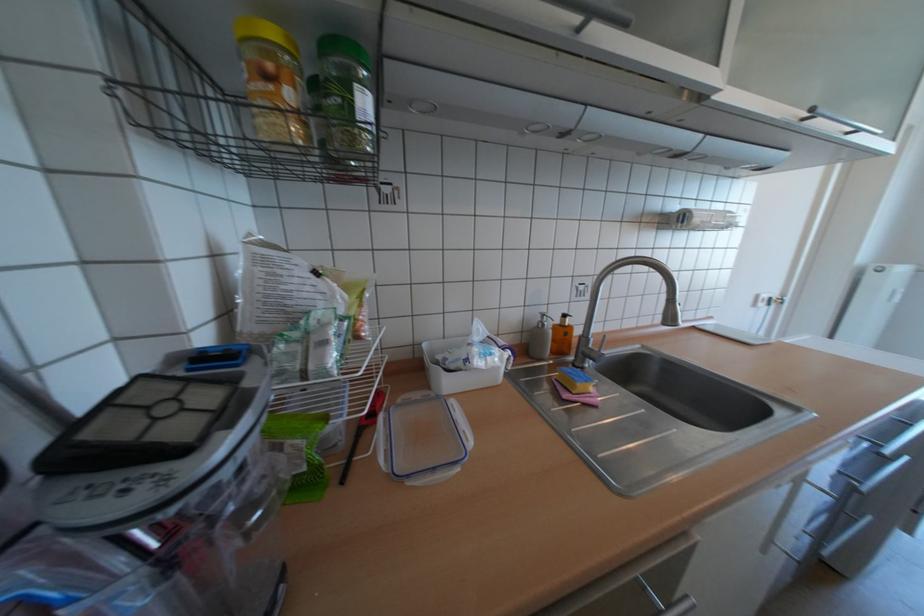
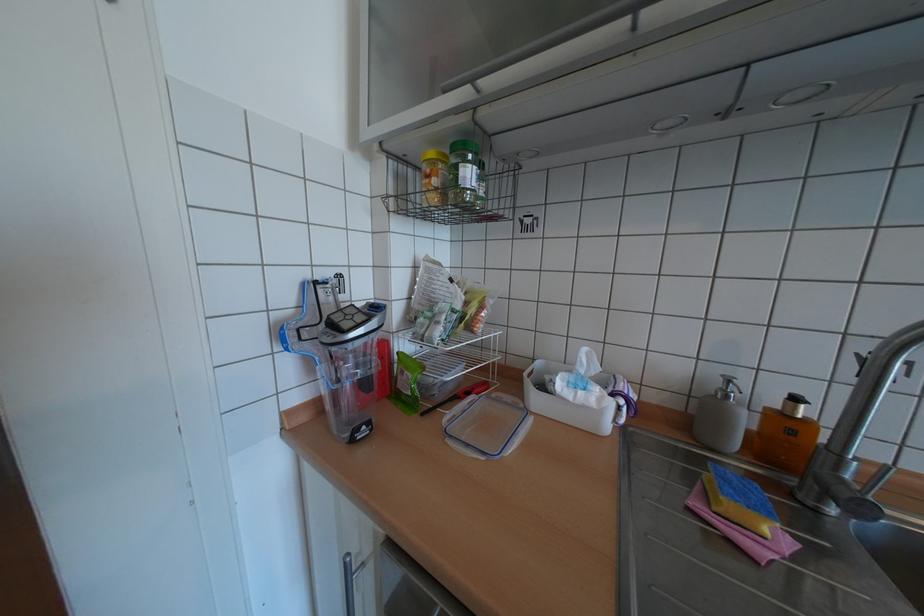
In the second image, find the point that corresponds to point 582,392 in the first image.

(723, 508)